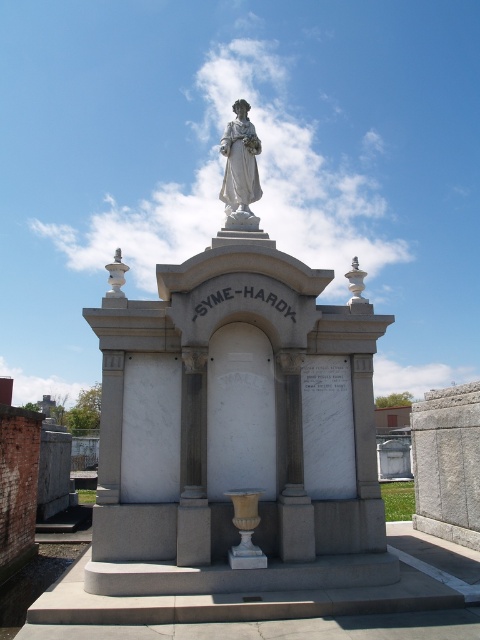
Question: Is white marble statue at center behind white marble statue at upper center?

Choices:
 (A) yes
 (B) no

Answer: (B)

Question: Is white marble statue at center closer to camera compared to white marble statue at upper center?

Choices:
 (A) no
 (B) yes

Answer: (B)

Question: Considering the relative positions of white marble statue at center and white marble statue at upper center in the image provided, where is white marble statue at center located with respect to white marble statue at upper center?

Choices:
 (A) above
 (B) below

Answer: (B)

Question: Which object appears farthest from the camera in this image?

Choices:
 (A) white marble statue at center
 (B) white marble statue at upper center

Answer: (B)

Question: Which object is closer to the camera taking this photo?

Choices:
 (A) white marble statue at upper center
 (B) white marble statue at center

Answer: (B)